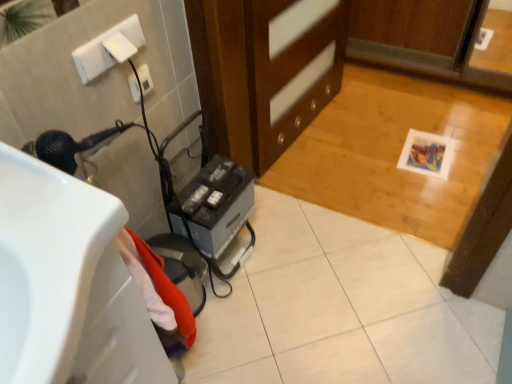
Question: Considering the relative positions of white glossy sink at lower left and white plastic electric outlet at upper left in the image provided, is white glossy sink at lower left to the left or to the right of white plastic electric outlet at upper left?

Choices:
 (A) right
 (B) left

Answer: (B)

Question: Looking at the image, does white glossy sink at lower left seem bigger or smaller compared to white plastic electric outlet at upper left?

Choices:
 (A) small
 (B) big

Answer: (B)

Question: Which of these objects is positioned closest to the white plastic electric outlet at upper left?

Choices:
 (A) wooden cabinet at center
 (B) metallic gray hair dryer at lower left
 (C) white glossy sink at lower left

Answer: (B)

Question: Based on their relative distances, which object is farther from the white glossy sink at lower left?

Choices:
 (A) wooden cabinet at center
 (B) metallic gray hair dryer at lower left
 (C) white plastic electric outlet at upper left

Answer: (A)